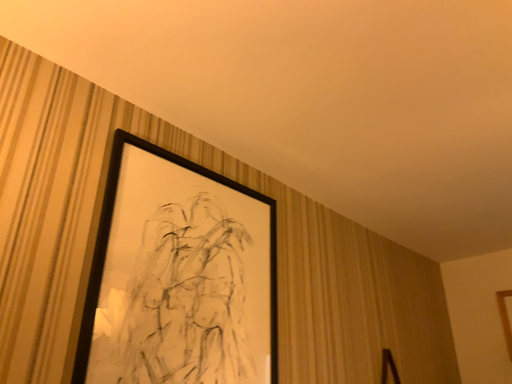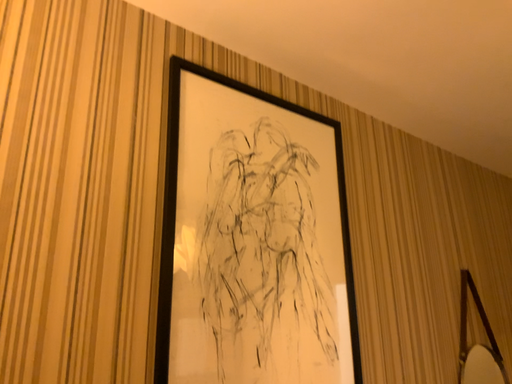
Question: How did the camera likely rotate when shooting the video?

Choices:
 (A) rotated left
 (B) rotated right

Answer: (A)